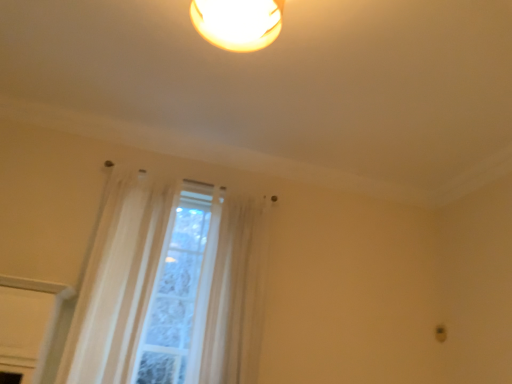
What do you see at coordinates (236, 294) in the screenshot? I see `sheer white curtain at center, the 1th curtain positioned from the right` at bounding box center [236, 294].

The height and width of the screenshot is (384, 512). I want to click on sheer white curtain at center, the 1th curtain positioned from the right, so click(x=236, y=294).

At what (x,y) coordinates should I click in order to perform the action: click on white sheer curtain at center, positioned as the 2th curtain in right-to-left order. Please return your answer as a coordinate pair (x, y). Image resolution: width=512 pixels, height=384 pixels. Looking at the image, I should click on (170, 286).

This screenshot has height=384, width=512. What do you see at coordinates (170, 286) in the screenshot?
I see `white sheer curtain at center, the first curtain when ordered from left to right` at bounding box center [170, 286].

In order to face white sheer curtain at center, positioned as the 2th curtain in right-to-left order, should I rotate leftwards or rightwards?

Rotate left and turn 16.861 degrees.

Where is `sheer white curtain at center, the 1th curtain positioned from the right`? This screenshot has width=512, height=384. sheer white curtain at center, the 1th curtain positioned from the right is located at coordinates (236, 294).

Is sheer white curtain at center, which appears as the second curtain when viewed from the left, to the left of white sheer curtain at center, the first curtain when ordered from left to right, from the viewer's perspective?

Incorrect, sheer white curtain at center, which appears as the second curtain when viewed from the left, is not on the left side of white sheer curtain at center, the first curtain when ordered from left to right.

Does sheer white curtain at center, which appears as the second curtain when viewed from the left, come behind white sheer curtain at center, positioned as the 2th curtain in right-to-left order?

Yes, sheer white curtain at center, which appears as the second curtain when viewed from the left, is further from the viewer.

Is point (210, 297) more distant than point (106, 264)?

Yes, point (210, 297) is farther from viewer.

From the image's perspective, which is below, sheer white curtain at center, which appears as the second curtain when viewed from the left, or white sheer curtain at center, positioned as the 2th curtain in right-to-left order?

sheer white curtain at center, which appears as the second curtain when viewed from the left, appears lower in the image.

From a real-world perspective, is sheer white curtain at center, the 1th curtain positioned from the right, positioned under white sheer curtain at center, the first curtain when ordered from left to right, based on gravity?

No.

Can you confirm if sheer white curtain at center, the 1th curtain positioned from the right, is wider than white sheer curtain at center, the first curtain when ordered from left to right?

Indeed, sheer white curtain at center, the 1th curtain positioned from the right, has a greater width compared to white sheer curtain at center, the first curtain when ordered from left to right.

From the picture: Can you confirm if sheer white curtain at center, the 1th curtain positioned from the right, is shorter than white sheer curtain at center, positioned as the 2th curtain in right-to-left order?

Yes, sheer white curtain at center, the 1th curtain positioned from the right, is shorter than white sheer curtain at center, positioned as the 2th curtain in right-to-left order.

Considering the relative sizes of sheer white curtain at center, which appears as the second curtain when viewed from the left, and white sheer curtain at center, positioned as the 2th curtain in right-to-left order, in the image provided, is sheer white curtain at center, which appears as the second curtain when viewed from the left, bigger than white sheer curtain at center, positioned as the 2th curtain in right-to-left order,?

Correct, sheer white curtain at center, which appears as the second curtain when viewed from the left, is larger in size than white sheer curtain at center, positioned as the 2th curtain in right-to-left order.

Would you say white sheer curtain at center, positioned as the 2th curtain in right-to-left order, is part of sheer white curtain at center, the 1th curtain positioned from the right,'s contents?

No, white sheer curtain at center, positioned as the 2th curtain in right-to-left order, is not surrounded by sheer white curtain at center, the 1th curtain positioned from the right.

Does sheer white curtain at center, which appears as the second curtain when viewed from the left, touch white sheer curtain at center, positioned as the 2th curtain in right-to-left order?

They are not placed beside each other.

Is sheer white curtain at center, which appears as the second curtain when viewed from the left, turned away from white sheer curtain at center, the first curtain when ordered from left to right?

sheer white curtain at center, which appears as the second curtain when viewed from the left, is not turned away from white sheer curtain at center, the first curtain when ordered from left to right.

How much distance is there between sheer white curtain at center, which appears as the second curtain when viewed from the left, and white sheer curtain at center, the first curtain when ordered from left to right?

sheer white curtain at center, which appears as the second curtain when viewed from the left, is 9.71 inches from white sheer curtain at center, the first curtain when ordered from left to right.

Find the location of a particular element. curtain that appears in front of the sheer white curtain at center, the 1th curtain positioned from the right is located at coordinates (170, 286).

Based on their positions, is white sheer curtain at center, positioned as the 2th curtain in right-to-left order, located to the left or right of sheer white curtain at center, the 1th curtain positioned from the right?

white sheer curtain at center, positioned as the 2th curtain in right-to-left order, is positioned on sheer white curtain at center, the 1th curtain positioned from the right,'s left side.

Which object is more forward, white sheer curtain at center, positioned as the 2th curtain in right-to-left order, or sheer white curtain at center, which appears as the second curtain when viewed from the left?

white sheer curtain at center, positioned as the 2th curtain in right-to-left order, is in front.

Considering the positions of points (129, 346) and (206, 357), is point (129, 346) farther from camera compared to point (206, 357)?

That is False.

From the image's perspective, is white sheer curtain at center, the first curtain when ordered from left to right, located above or below sheer white curtain at center, which appears as the second curtain when viewed from the left?

Based on their image positions, white sheer curtain at center, the first curtain when ordered from left to right, is located above sheer white curtain at center, which appears as the second curtain when viewed from the left.

Consider the image. From a real-world perspective, is white sheer curtain at center, the first curtain when ordered from left to right, above or below sheer white curtain at center, the 1th curtain positioned from the right?

In terms of real-world spatial position, white sheer curtain at center, the first curtain when ordered from left to right, is below sheer white curtain at center, the 1th curtain positioned from the right.

Considering the relative sizes of white sheer curtain at center, the first curtain when ordered from left to right, and sheer white curtain at center, which appears as the second curtain when viewed from the left, in the image provided, is white sheer curtain at center, the first curtain when ordered from left to right, thinner than sheer white curtain at center, which appears as the second curtain when viewed from the left,?

Yes, white sheer curtain at center, the first curtain when ordered from left to right, is thinner than sheer white curtain at center, which appears as the second curtain when viewed from the left.

Does white sheer curtain at center, the first curtain when ordered from left to right, have a lesser height compared to sheer white curtain at center, the 1th curtain positioned from the right?

No, white sheer curtain at center, the first curtain when ordered from left to right, is not shorter than sheer white curtain at center, the 1th curtain positioned from the right.

Does white sheer curtain at center, the first curtain when ordered from left to right, have a smaller size compared to sheer white curtain at center, the 1th curtain positioned from the right?

Yes, white sheer curtain at center, the first curtain when ordered from left to right, is smaller than sheer white curtain at center, the 1th curtain positioned from the right.

Looking at this image, is white sheer curtain at center, positioned as the 2th curtain in right-to-left order, outside of sheer white curtain at center, the 1th curtain positioned from the right?

That's correct, white sheer curtain at center, positioned as the 2th curtain in right-to-left order, is outside of sheer white curtain at center, the 1th curtain positioned from the right.

Is white sheer curtain at center, positioned as the 2th curtain in right-to-left order, not near sheer white curtain at center, the 1th curtain positioned from the right?

No.

Is white sheer curtain at center, the first curtain when ordered from left to right, facing towards sheer white curtain at center, which appears as the second curtain when viewed from the left?

No.

Identify the location of curtain beneath the sheer white curtain at center, the 1th curtain positioned from the right (from a real-world perspective). click(x=170, y=286).

In the image, there is a sheer white curtain at center, the 1th curtain positioned from the right. Identify the location of curtain below it (from a real-world perspective). (170, 286).

Find the location of a particular element. curtain that is behind the white sheer curtain at center, positioned as the 2th curtain in right-to-left order is located at coordinates (236, 294).